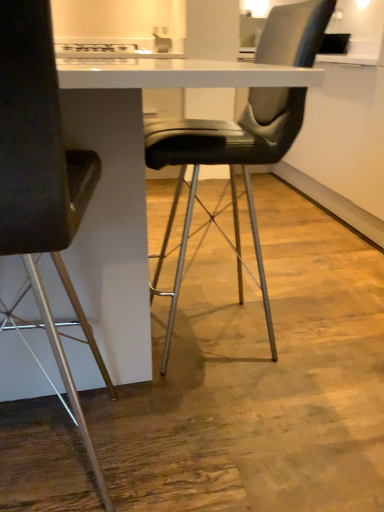
The image size is (384, 512). Find the location of `unoccupied region to the right of black leather chair at center, the first chair positioned from the right`. unoccupied region to the right of black leather chair at center, the first chair positioned from the right is located at coordinates (331, 327).